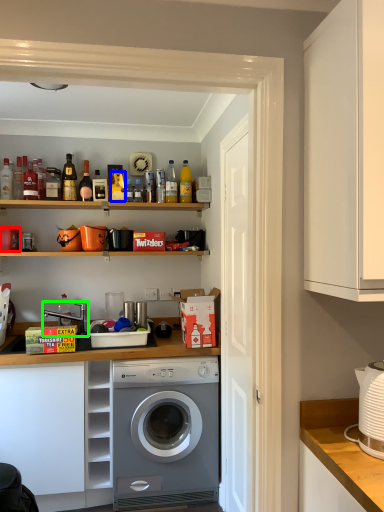
Question: Estimate the real-world distances between objects in this image. Which object is closer to appliance (highlighted by a red box), bottle (highlighted by a blue box) or sink (highlighted by a green box)?

Choices:
 (A) bottle
 (B) sink

Answer: (B)